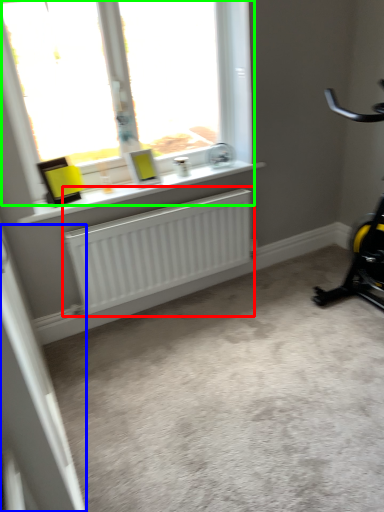
Question: Which object is the farthest from radiator (highlighted by a red box)? Choose among these: screen door (highlighted by a blue box) or window (highlighted by a green box).

Choices:
 (A) screen door
 (B) window

Answer: (A)